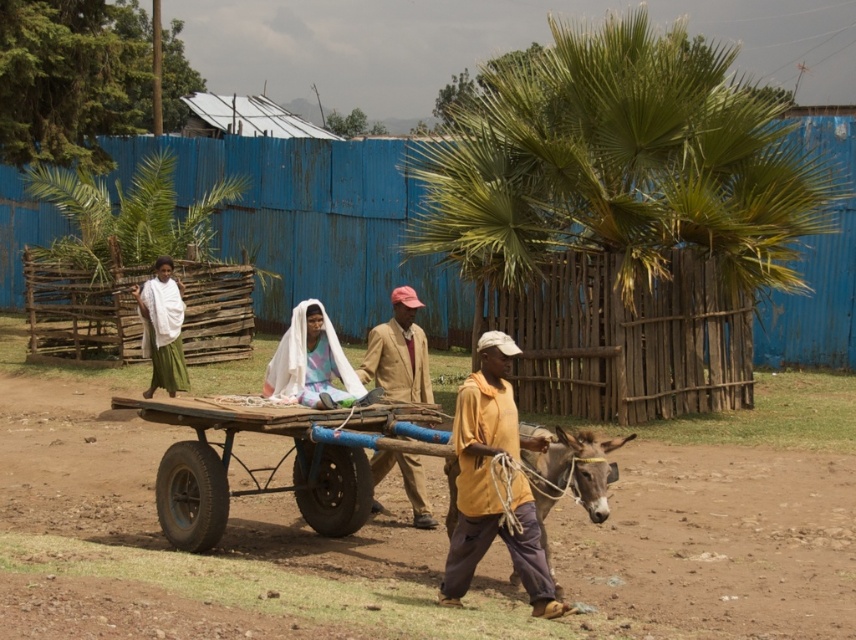
Who is positioned more to the right, green leafy palm tree at center or wooden cart at center?

Positioned to the right is green leafy palm tree at center.

Where is `green leafy palm tree at center`? The height and width of the screenshot is (640, 856). green leafy palm tree at center is located at coordinates (621, 214).

Is brown dirt field at center shorter than yellow matte shirt at center?

Correct, brown dirt field at center is not as tall as yellow matte shirt at center.

Does brown dirt field at center come behind yellow matte shirt at center?

No, it is not.

Where is `brown dirt field at center`? brown dirt field at center is located at coordinates 428,534.

In the scene shown: Is brown dirt field at center below white cloth at center?

Indeed, brown dirt field at center is positioned under white cloth at center.

Does brown dirt field at center have a smaller size compared to white cloth at center?

Actually, brown dirt field at center might be larger than white cloth at center.

This screenshot has height=640, width=856. I want to click on brown dirt field at center, so click(x=428, y=534).

Where is `brown dirt field at center`? This screenshot has height=640, width=856. brown dirt field at center is located at coordinates (428, 534).